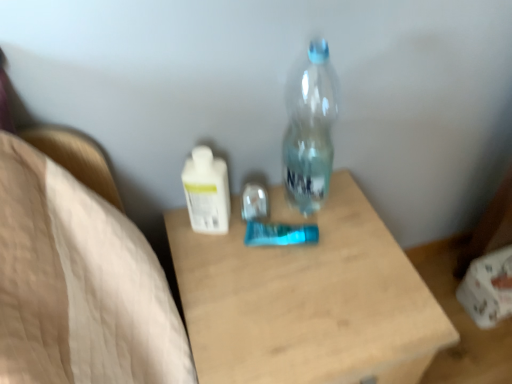
What do you see at coordinates (207, 191) in the screenshot? The width and height of the screenshot is (512, 384). I see `white glossy lotion at center, marked as the 2th bottle in a right-to-left arrangement` at bounding box center [207, 191].

What are the coordinates of `transparent plastic bottle at center, which appears as the first bottle when viewed from the right` in the screenshot? It's located at (310, 129).

The image size is (512, 384). In order to click on wooden table at center in this screenshot , I will do `click(306, 299)`.

Starting from the wooden table at center, which bottle is the 2nd one behind? Please provide its 2D coordinates.

[(207, 191)]

Is wooden table at center in front of or behind white glossy lotion at center, marked as the 2th bottle in a right-to-left arrangement, in the image?

wooden table at center is positioned closer to the viewer than white glossy lotion at center, marked as the 2th bottle in a right-to-left arrangement.

Which is farther, (233, 318) or (225, 222)?

The point (225, 222) is farther from the camera.

From the image's perspective, which one is positioned lower, transparent plastic bottle at center, which appears as the 2th bottle when viewed from the left, or wooden table at center?

From the image's view, wooden table at center is below.

Does transparent plastic bottle at center, which appears as the 2th bottle when viewed from the left, have a greater width compared to wooden table at center?

Incorrect, the width of transparent plastic bottle at center, which appears as the 2th bottle when viewed from the left, does not surpass that of wooden table at center.

From a real-world perspective, is transparent plastic bottle at center, which appears as the first bottle when viewed from the right, physically below wooden table at center?

No.

Considering the sizes of objects white glossy lotion at center, marked as the 2th bottle in a right-to-left arrangement, and wooden table at center in the image provided, who is shorter, white glossy lotion at center, marked as the 2th bottle in a right-to-left arrangement, or wooden table at center?

white glossy lotion at center, marked as the 2th bottle in a right-to-left arrangement, is shorter.

Looking at this image, does white glossy lotion at center, the 1th bottle viewed from the left, come in front of wooden table at center?

No, it is not.

From a real-world perspective, is white glossy lotion at center, the 1th bottle viewed from the left, located higher than wooden table at center?

Yes, from a real-world perspective, white glossy lotion at center, the 1th bottle viewed from the left, is over wooden table at center

Can wooden table at center be found inside white glossy lotion at center, marked as the 2th bottle in a right-to-left arrangement?

Actually, wooden table at center is outside white glossy lotion at center, marked as the 2th bottle in a right-to-left arrangement.

Which is behind, point (208, 190) or point (329, 175)?

The point (329, 175) is farther from the camera.

From a real-world perspective, is white glossy lotion at center, the 1th bottle viewed from the left, above or below transparent plastic bottle at center, which appears as the 2th bottle when viewed from the left?

Clearly, from a real-world perspective, white glossy lotion at center, the 1th bottle viewed from the left, is below transparent plastic bottle at center, which appears as the 2th bottle when viewed from the left.

From the image's perspective, is white glossy lotion at center, the 1th bottle viewed from the left, positioned above or below transparent plastic bottle at center, which appears as the first bottle when viewed from the right?

Based on their image positions, white glossy lotion at center, the 1th bottle viewed from the left, is located beneath transparent plastic bottle at center, which appears as the first bottle when viewed from the right.

Which object is positioned more to the right, white glossy lotion at center, the 1th bottle viewed from the left, or transparent plastic bottle at center, which appears as the 2th bottle when viewed from the left?

transparent plastic bottle at center, which appears as the 2th bottle when viewed from the left, is more to the right.

Consider the image. Are wooden table at center and transparent plastic bottle at center, which appears as the first bottle when viewed from the right, beside each other?

No, wooden table at center is not making contact with transparent plastic bottle at center, which appears as the first bottle when viewed from the right.

Is wooden table at center outside of transparent plastic bottle at center, which appears as the 2th bottle when viewed from the left?

Absolutely, wooden table at center is external to transparent plastic bottle at center, which appears as the 2th bottle when viewed from the left.

From a real-world perspective, is wooden table at center above or below transparent plastic bottle at center, which appears as the first bottle when viewed from the right?

wooden table at center is situated lower than transparent plastic bottle at center, which appears as the first bottle when viewed from the right, in the real world.

Is transparent plastic bottle at center, which appears as the first bottle when viewed from the right, turned away from white glossy lotion at center, marked as the 2th bottle in a right-to-left arrangement?

transparent plastic bottle at center, which appears as the first bottle when viewed from the right, does not have its back to white glossy lotion at center, marked as the 2th bottle in a right-to-left arrangement.

Is transparent plastic bottle at center, which appears as the 2th bottle when viewed from the left, far away from white glossy lotion at center, marked as the 2th bottle in a right-to-left arrangement?

No.

Starting from the wooden table at center, which bottle is the 2nd one behind? Please provide its 2D coordinates.

[(207, 191)]

Where is `table below the transparent plastic bottle at center, which appears as the 2th bottle when viewed from the left (from the image's perspective)`? The image size is (512, 384). table below the transparent plastic bottle at center, which appears as the 2th bottle when viewed from the left (from the image's perspective) is located at coordinates (306, 299).

Considering their positions, is transparent plastic bottle at center, which appears as the 2th bottle when viewed from the left, positioned further to white glossy lotion at center, the 1th bottle viewed from the left, than wooden table at center?

wooden table at center.

Looking at the image, which one is located closer to white glossy lotion at center, marked as the 2th bottle in a right-to-left arrangement, wooden table at center or transparent plastic bottle at center, which appears as the 2th bottle when viewed from the left?

transparent plastic bottle at center, which appears as the 2th bottle when viewed from the left, is closer to white glossy lotion at center, marked as the 2th bottle in a right-to-left arrangement.

When comparing their distances from transparent plastic bottle at center, which appears as the first bottle when viewed from the right, does white glossy lotion at center, marked as the 2th bottle in a right-to-left arrangement, or wooden table at center seem further?

Among the two, wooden table at center is located further to transparent plastic bottle at center, which appears as the first bottle when viewed from the right.

Looking at the image, which one is located further to transparent plastic bottle at center, which appears as the 2th bottle when viewed from the left, wooden table at center or white glossy lotion at center, the 1th bottle viewed from the left?

Based on the image, wooden table at center appears to be further to transparent plastic bottle at center, which appears as the 2th bottle when viewed from the left.

When comparing their distances from wooden table at center, does transparent plastic bottle at center, which appears as the 2th bottle when viewed from the left, or white glossy lotion at center, the 1th bottle viewed from the left, seem further?

white glossy lotion at center, the 1th bottle viewed from the left.

Considering their positions, is white glossy lotion at center, the 1th bottle viewed from the left, positioned closer to wooden table at center than transparent plastic bottle at center, which appears as the first bottle when viewed from the right?

transparent plastic bottle at center, which appears as the first bottle when viewed from the right, lies closer to wooden table at center than the other object.

Find the location of a particular element. The image size is (512, 384). bottle between transparent plastic bottle at center, which appears as the 2th bottle when viewed from the left, and wooden table at center, in the vertical direction is located at coordinates (207, 191).